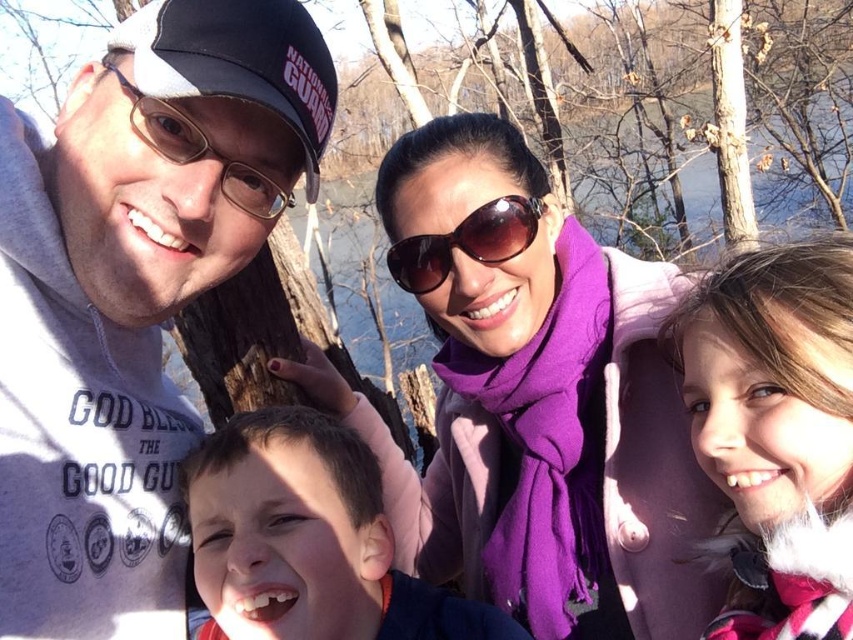
Is brown reflective sunglasses at center to the right of matte black goggles at left from the viewer's perspective?

Correct, you'll find brown reflective sunglasses at center to the right of matte black goggles at left.

Who is more distant from viewer, (451, 237) or (267, 211)?

Positioned behind is point (451, 237).

The width and height of the screenshot is (853, 640). I want to click on brown reflective sunglasses at center, so click(x=465, y=243).

Which is above, purple wool scarf at center or brown reflective sunglasses at center?

brown reflective sunglasses at center is above.

Is purple wool scarf at center behind brown reflective sunglasses at center?

No.

Is point (670, 304) positioned behind point (404, 241)?

No, it is in front of (404, 241).

This screenshot has height=640, width=853. Identify the location of purple wool scarf at center. (535, 400).

Between gray cotton hoodie at left and brown reflective sunglasses at center, which one appears on the left side from the viewer's perspective?

Positioned to the left is gray cotton hoodie at left.

Who is shorter, gray cotton hoodie at left or brown reflective sunglasses at center?

brown reflective sunglasses at center

Between point (148, 172) and point (450, 256), which one is positioned in front?

Point (148, 172) is in front.

This screenshot has height=640, width=853. Identify the location of gray cotton hoodie at left. (132, 294).